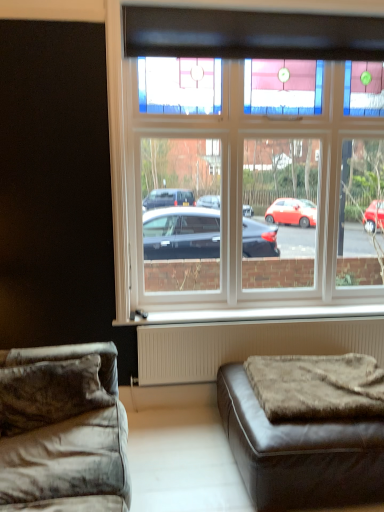
Locate an element on the screen. blank space above white plastic window sill at lower center (from a real-world perspective) is located at coordinates click(x=243, y=310).